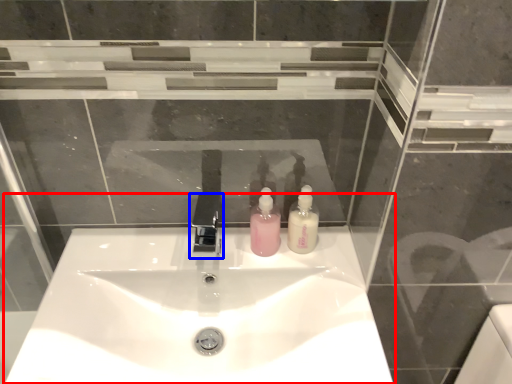
Question: Which object appears farthest to the camera in this image, sink (highlighted by a red box) or tap (highlighted by a blue box)?

Choices:
 (A) sink
 (B) tap

Answer: (B)